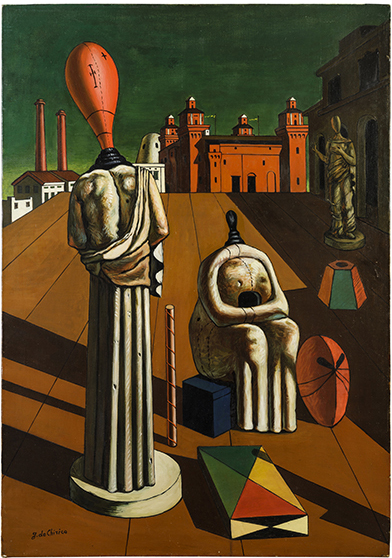
The height and width of the screenshot is (558, 392). Find the location of `surface`. surface is located at coordinates (194, 226).